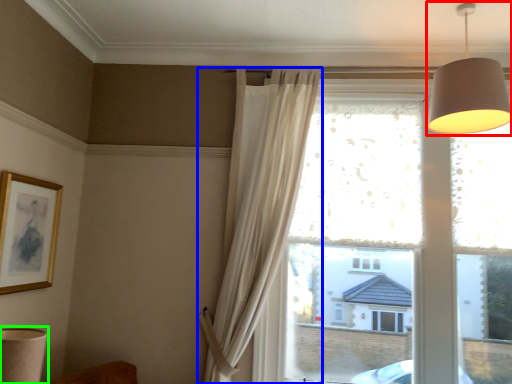
Question: Based on their relative distances, which object is farther from lamp (highlighted by a red box)? Choose from curtain (highlighted by a blue box) and table lamp (highlighted by a green box).

Choices:
 (A) curtain
 (B) table lamp

Answer: (B)